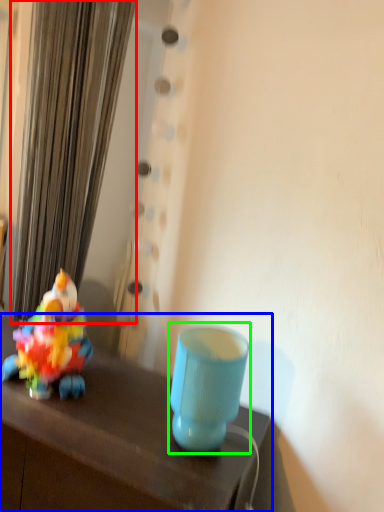
Question: Which is nearer to the curtain (highlighted by a red box)? table (highlighted by a blue box) or table lamp (highlighted by a green box).

Choices:
 (A) table
 (B) table lamp

Answer: (A)